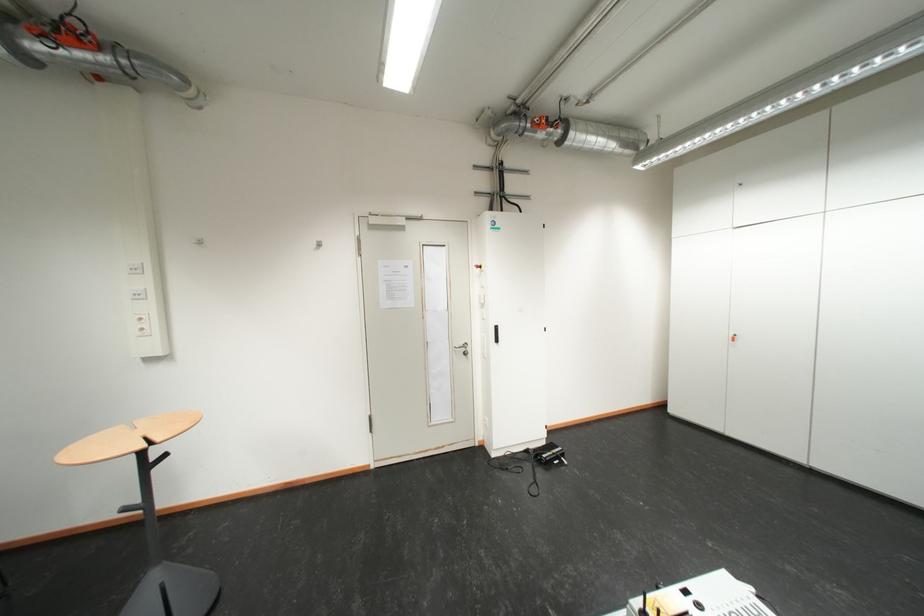
At what (x,y) coordinates should I click in order to perform the action: click on white cardboard box. Please return your answer as a coordinate pair (x, y). The image size is (924, 616). Looking at the image, I should click on (700, 598).